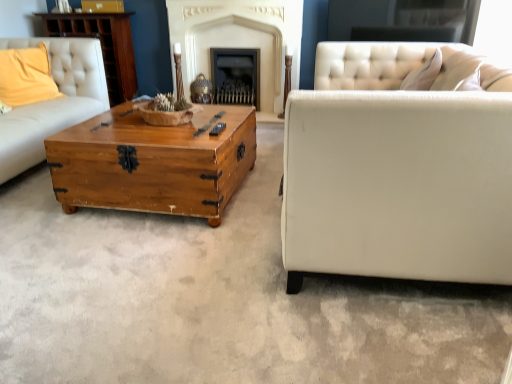
The width and height of the screenshot is (512, 384). Identify the location of free spot in front of wooden trunk at center. (161, 271).